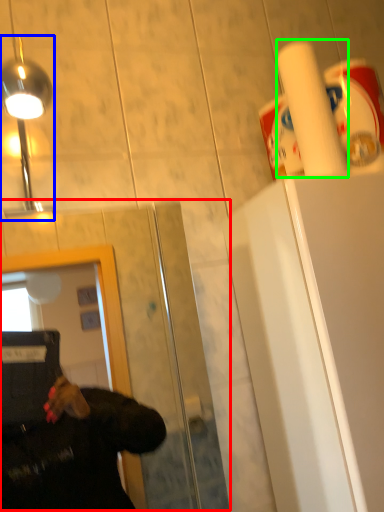
Question: Which object is positioned closest to glass door (highlighted by a red box)? Select from light fixture (highlighted by a blue box) and paper towel (highlighted by a green box).

Choices:
 (A) light fixture
 (B) paper towel

Answer: (B)